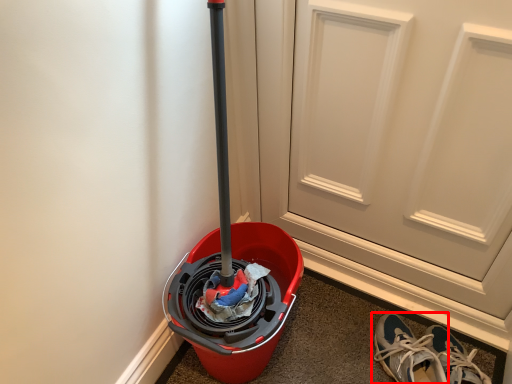
Question: Where is footwear (annotated by the red box) located in relation to door in the image?

Choices:
 (A) left
 (B) right

Answer: (B)